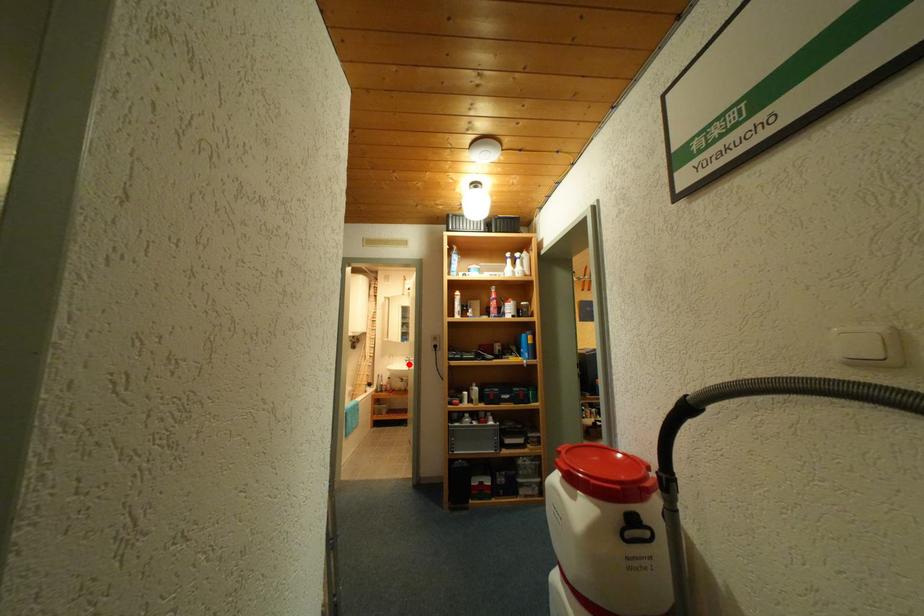
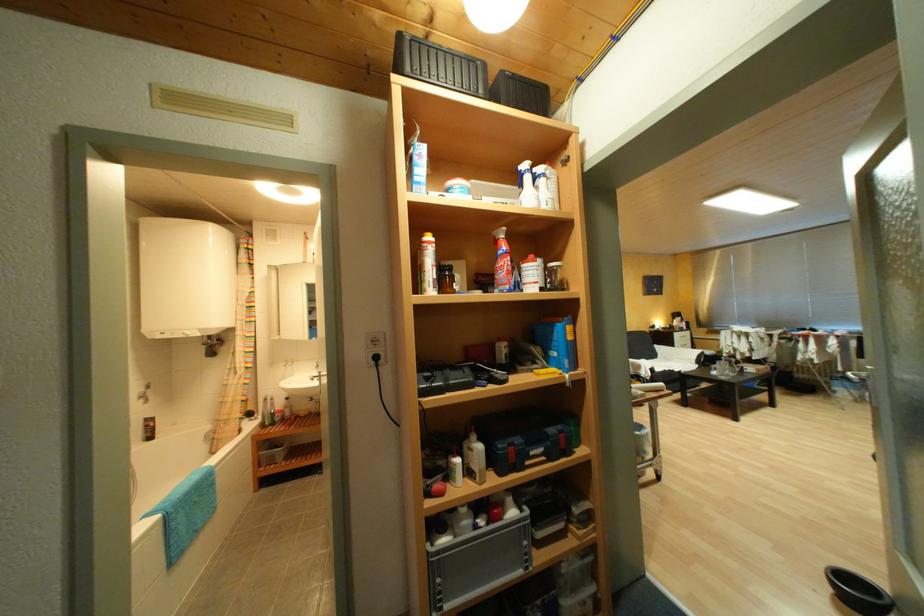
Question: I am providing you with two images of the same scene from different viewpoints. Image1 has a red point marked. In image2, the corresponding 3D location appears at what relative position? Reply with the corresponding letter.

Choices:
 (A) Closer
 (B) Farther

Answer: (A)